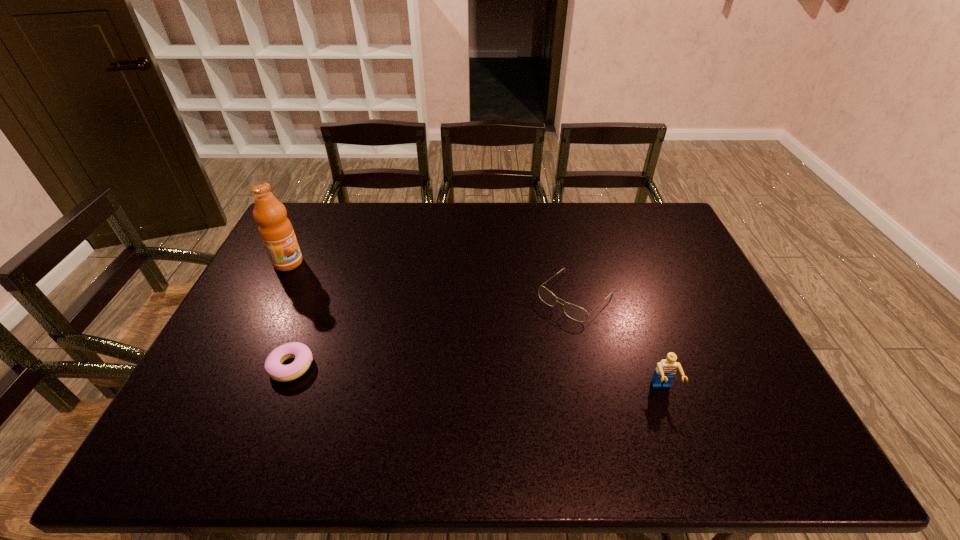
Where is `unoccupied position between the Lego and the doughnut`? unoccupied position between the Lego and the doughnut is located at coordinates (477, 378).

Find the location of a particular element. The image size is (960, 540). free space that is in between the leftmost object and the third object from left to right is located at coordinates (431, 280).

What are the coordinates of `free space between the spectacles and the tallest object` in the screenshot? It's located at (431, 280).

What are the coordinates of `vacant point located between the third object from left to right and the doughnut` in the screenshot? It's located at (433, 332).

This screenshot has width=960, height=540. What are the coordinates of `free space that is in between the doughnut and the tallest object` in the screenshot? It's located at (290, 315).

The width and height of the screenshot is (960, 540). Find the location of `vacant area between the leftmost object and the third object from left to right`. vacant area between the leftmost object and the third object from left to right is located at coordinates (431, 280).

Locate which object is the closest to the leftmost object. Please provide its 2D coordinates. Your answer should be formatted as a tuple, i.e. [(x, y)], where the tuple contains the x and y coordinates of a point satisfying the conditions above.

[(273, 365)]

Image resolution: width=960 pixels, height=540 pixels. I want to click on the third closest object to the spectacles, so click(x=276, y=231).